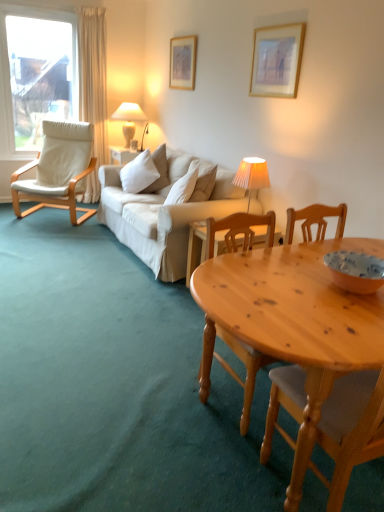
Question: From a real-world perspective, is natural wood table at lower right above or below white pleated fabric lampshade at center, the second lamp positioned from the back?

Choices:
 (A) below
 (B) above

Answer: (A)

Question: Is point (357, 323) positioned closer to the camera than point (241, 180)?

Choices:
 (A) farther
 (B) closer

Answer: (B)

Question: Which is nearer to the white ceramic lamp at upper center, placed as the first lamp when sorted from top to bottom?

Choices:
 (A) wooden picture frame at upper center, positioned as the second picture frame in right-to-left order
 (B) white pleated fabric lampshade at center, which is the 2th lamp from top to bottom
 (C) white fabric chair at left
 (D) white soft cushion at center
 (E) natural wood table at lower right

Answer: (C)

Question: Estimate the real-world distances between objects in this image. Which object is closer to the natural wood table at lower right?

Choices:
 (A) white soft cushion at center
 (B) wooden picture frame at upper center, which ranks as the 2th picture frame in top-to-bottom order
 (C) matte orange bowl at lower right
 (D) white pleated fabric lampshade at center, which is the first lamp in front-to-back order
 (E) white ceramic lamp at upper center, the first lamp in the left-to-right sequence

Answer: (C)